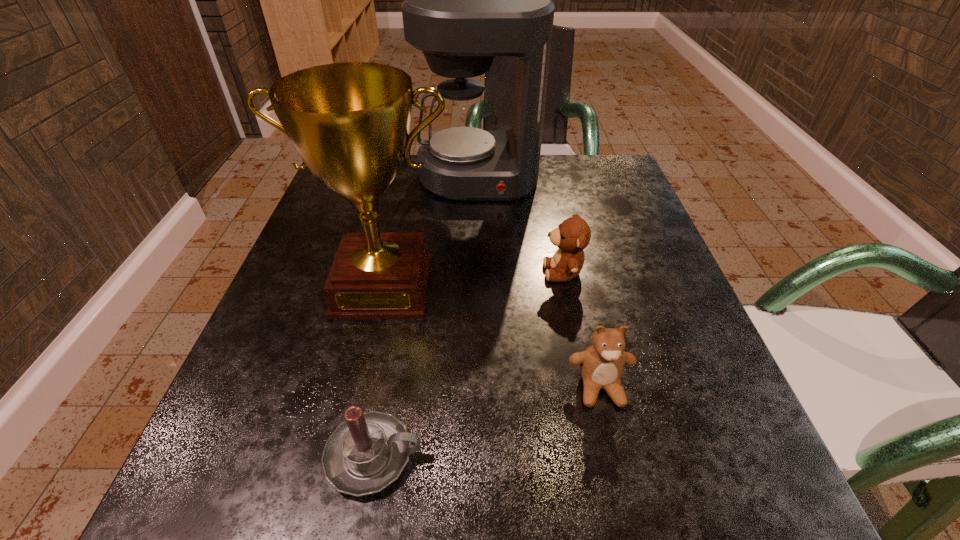
What are the coordinates of `the farthest object` in the screenshot? It's located at (466, 0).

Identify the location of award. (349, 122).

Identify the location of the farther teddy bear. (573, 235).

The height and width of the screenshot is (540, 960). I want to click on the second nearest object, so click(x=601, y=365).

What are the coordinates of `the nearest object` in the screenshot? It's located at (366, 453).

Identify the location of free space located on the button side of the coffee maker. The image size is (960, 540). (478, 217).

Where is `vacant region located on the plaque of the award`? This screenshot has width=960, height=540. vacant region located on the plaque of the award is located at coordinates (334, 498).

In order to click on free location located on the face of the farther teddy bear in this screenshot , I will do `click(324, 272)`.

Identify the location of free region located 0.350m on the face of the farther teddy bear. (351, 272).

Image resolution: width=960 pixels, height=540 pixels. Find the location of `vacant area situated 0.310m on the face of the farther teddy bear`. vacant area situated 0.310m on the face of the farther teddy bear is located at coordinates (373, 272).